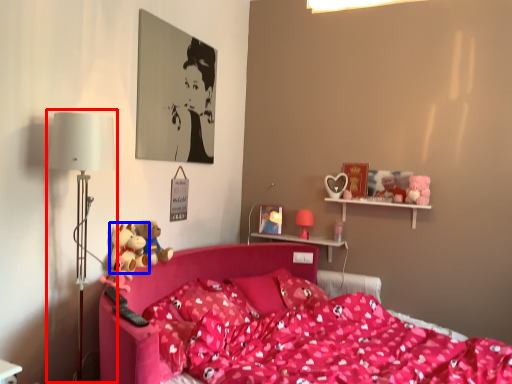
Question: Among these objects, which one is nearest to the camera, table lamp (highlighted by a red box) or toy (highlighted by a blue box)?

Choices:
 (A) table lamp
 (B) toy

Answer: (A)